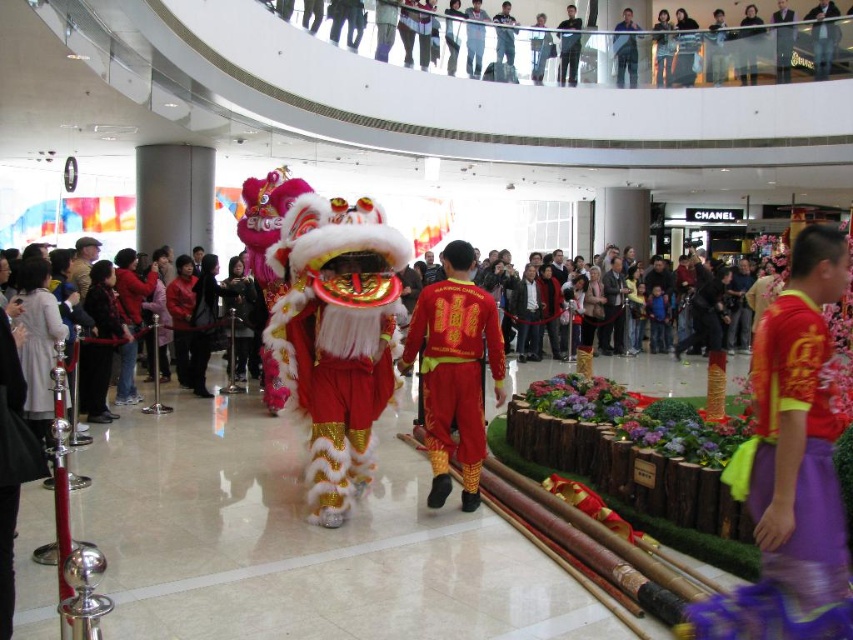
Question: Which point is farther to the camera?

Choices:
 (A) (618, 77)
 (B) (479, 392)
 (C) (795, 624)
 (D) (561, 22)

Answer: (D)

Question: Is red satin costume at center to the left of matte black jacket at upper center from the viewer's perspective?

Choices:
 (A) no
 (B) yes

Answer: (B)

Question: Among these points, which one is farthest from the camera?

Choices:
 (A) (780, 20)
 (B) (451, 314)
 (C) (616, 83)

Answer: (A)

Question: Among these points, which one is farthest from the camera?

Choices:
 (A) (782, 64)
 (B) (624, 26)

Answer: (B)

Question: Is red satin costume at center below blue fabric shirt at upper center?

Choices:
 (A) yes
 (B) no

Answer: (A)

Question: Is red satin skirt at lower right smaller than dark gray pants at upper center?

Choices:
 (A) yes
 (B) no

Answer: (A)